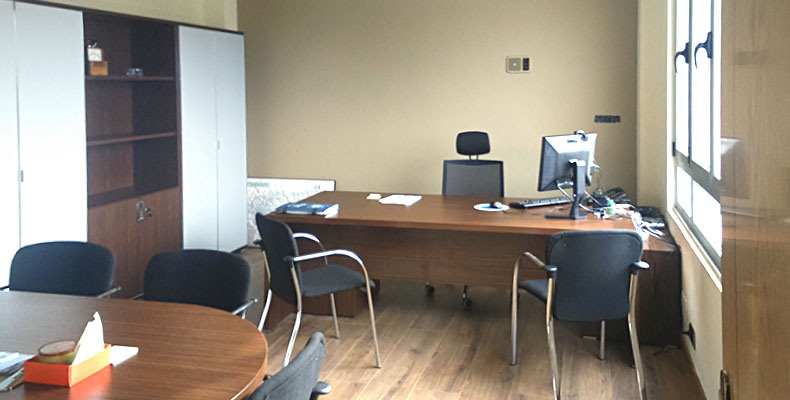
This screenshot has height=400, width=790. Identify the location of keyboard. (529, 204).